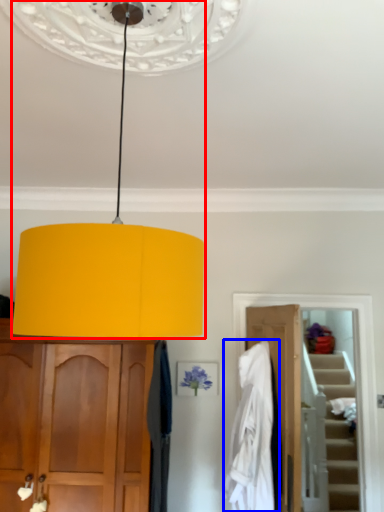
Question: Which object appears closest to the camera in this image, lamp (highlighted by a red box) or clothing (highlighted by a blue box)?

Choices:
 (A) lamp
 (B) clothing

Answer: (A)